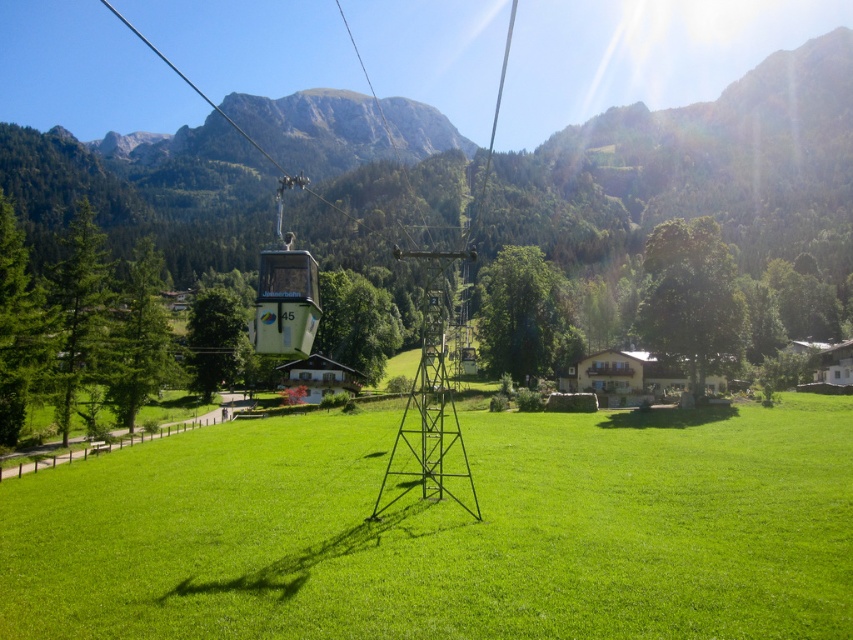
Can you confirm if green grass at center is positioned to the left of green matte cable car at center?

In fact, green grass at center is to the right of green matte cable car at center.

Which is more to the left, green grass at center or green matte cable car at center?

green matte cable car at center

The height and width of the screenshot is (640, 853). I want to click on green grass at center, so click(x=447, y=531).

In order to click on green grass at center in this screenshot , I will do `click(447, 531)`.